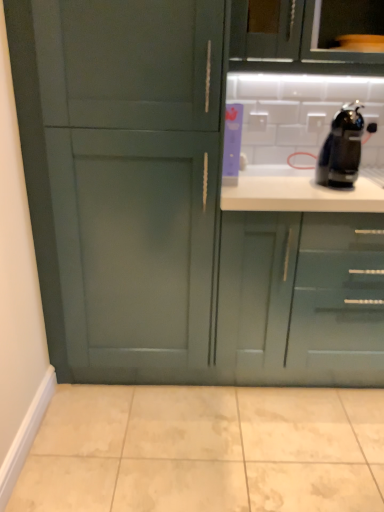
Question: From the image's perspective, relative to black glossy coffee machine at upper right, is green matte cabinet at upper center, which is the second cabinetry in right-to-left order, above or below?

Choices:
 (A) above
 (B) below

Answer: (A)

Question: From a real-world perspective, is green matte cabinet at upper center, the second cabinetry in the left-to-right sequence, positioned above or below black glossy coffee machine at upper right?

Choices:
 (A) above
 (B) below

Answer: (A)

Question: Which is farther from the green matte cabinet at upper center, which is the second cabinetry in right-to-left order?

Choices:
 (A) beige marble tile at lower center
 (B) glossy teal cabinet at lower right, marked as the 1th cabinetry in a right-to-left arrangement
 (C) matte green cabinet at center, the first cabinetry positioned from the left
 (D) black glossy coffee machine at upper right

Answer: (A)

Question: Which object is positioned farthest from the black glossy coffee machine at upper right?

Choices:
 (A) beige marble tile at lower center
 (B) glossy teal cabinet at lower right, marked as the 3th cabinetry in a left-to-right arrangement
 (C) matte green cabinet at center, the third cabinetry viewed from the right
 (D) green matte cabinet at upper center, which is the second cabinetry in right-to-left order

Answer: (A)